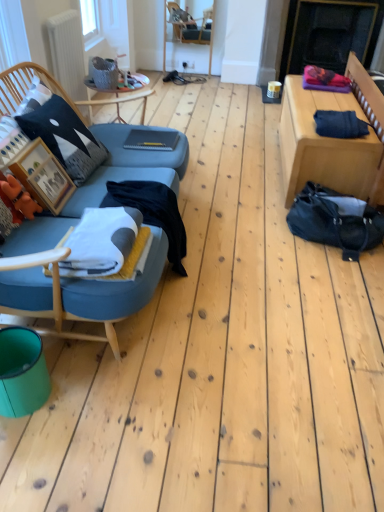
Question: Choose the correct answer: Is white soft blanket at center inside wooden chair at center or outside it?

Choices:
 (A) inside
 (B) outside

Answer: (B)

Question: From a real-world perspective, is white soft blanket at center above or below wooden chair at center?

Choices:
 (A) below
 (B) above

Answer: (B)

Question: Which is farther from the orange plush toy at lower left?

Choices:
 (A) matte black pillow at left
 (B) white matte radiator at upper left
 (C) white soft blanket at center
 (D) wooden picture frame at left
 (E) black matte fireplace at upper right

Answer: (E)

Question: Which is farther from the black matte fireplace at upper right?

Choices:
 (A) wooden tray at upper left, the 2th table when ordered from right to left
 (B) teal plastic bin at lower left
 (C) denim fabric at right, acting as the first table starting from the right
 (D) matte black pillow at left
 (E) white matte radiator at upper left

Answer: (B)